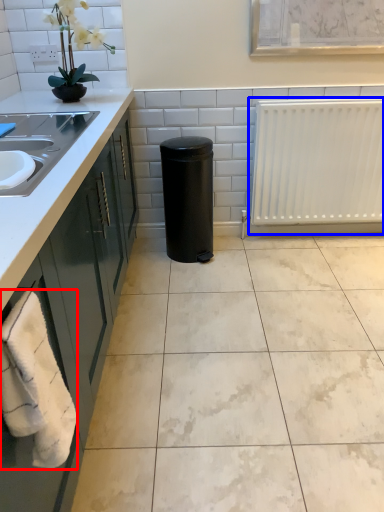
Question: Which object appears closest to the camera in this image, bath towel (highlighted by a red box) or radiator (highlighted by a blue box)?

Choices:
 (A) bath towel
 (B) radiator

Answer: (A)